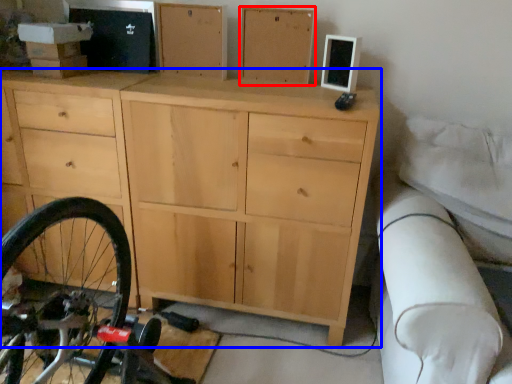
Question: Which point is closer to the camera, chest of drawer (highlighted by a red box) or chest of drawers (highlighted by a blue box)?

Choices:
 (A) chest of drawer
 (B) chest of drawers

Answer: (B)